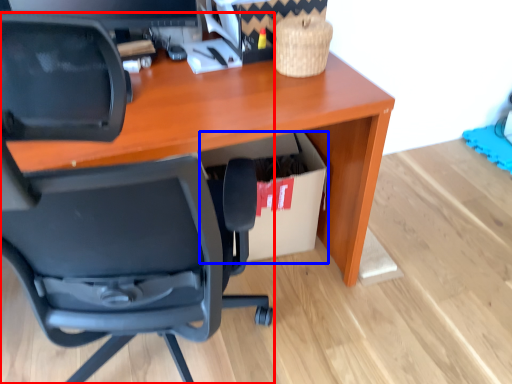
Question: Which object appears closest to the camera in this image, chair (highlighted by a red box) or cardboard box (highlighted by a blue box)?

Choices:
 (A) chair
 (B) cardboard box

Answer: (A)